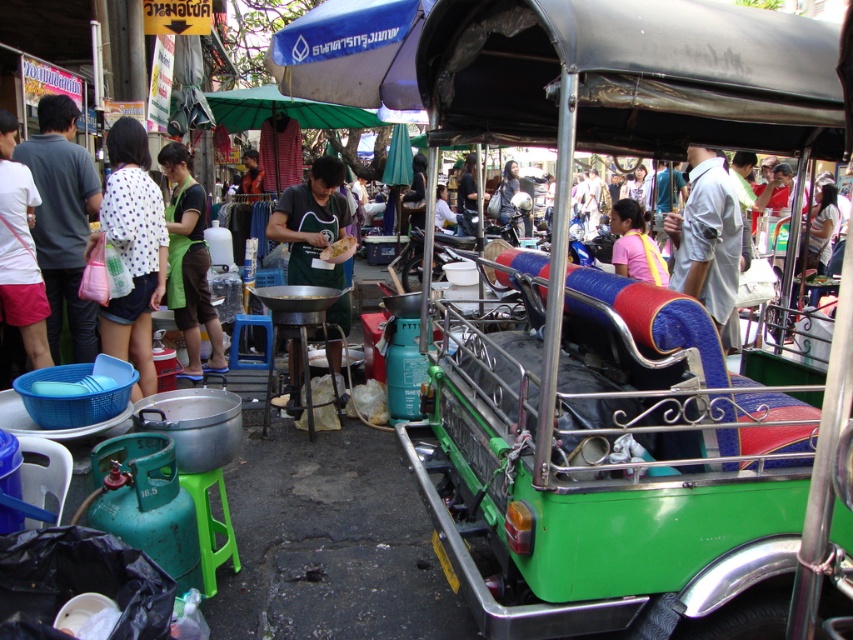
Can you confirm if white cotton shirt at left is positioned to the right of pink fabric bag at center?

No, white cotton shirt at left is not to the right of pink fabric bag at center.

Who is more distant from viewer, (32, 180) or (640, 268)?

→ The point (640, 268) is more distant.

You are a GUI agent. You are given a task and a screenshot of the screen. Output one action in this format:
    pyautogui.click(x=<x>, y=<y>)
    Task: Click on the white cotton shirt at left
    This screenshot has width=853, height=640.
    Given the screenshot: What is the action you would take?
    pyautogui.click(x=19, y=252)

Does green matte apron at center have a greater height compared to pink fabric bag at center?

Yes.

Looking at this image, does green matte apron at center have a lesser height compared to pink fabric bag at center?

In fact, green matte apron at center may be taller than pink fabric bag at center.

What do you see at coordinates (312, 224) in the screenshot? I see `green matte apron at center` at bounding box center [312, 224].

Find the location of a particular element. green matte apron at center is located at coordinates (312, 224).

Based on the photo, who is positioned more to the left, white dotted shirt at left or green apron at center?

Positioned to the left is green apron at center.

Who is lower down, white dotted shirt at left or green apron at center?

Positioned lower is white dotted shirt at left.

Who is more distant from viewer, (102, 221) or (169, 300)?

The point (169, 300) is behind.

You are a GUI agent. You are given a task and a screenshot of the screen. Output one action in this format:
    pyautogui.click(x=<x>, y=<y>)
    Task: Click on the white dotted shirt at left
    
    Given the screenshot: What is the action you would take?
    pyautogui.click(x=132, y=250)